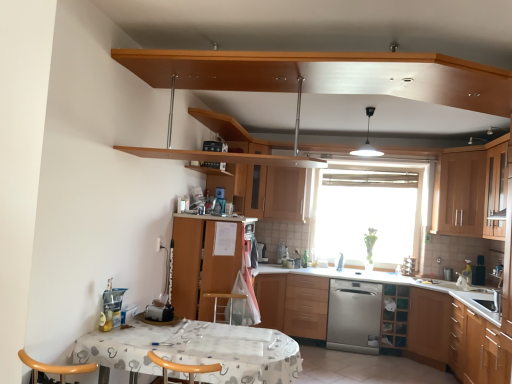
Question: Is transparent glass window at center behind wooden cabinet at center, arranged as the 6th cabinetry when viewed from the right?

Choices:
 (A) yes
 (B) no

Answer: (A)

Question: Considering the relative sizes of transparent glass window at center and wooden cabinet at center, which appears as the 1th cabinetry when viewed from the left, in the image provided, is transparent glass window at center bigger than wooden cabinet at center, which appears as the 1th cabinetry when viewed from the left,?

Choices:
 (A) yes
 (B) no

Answer: (B)

Question: Is transparent glass window at center facing towards wooden cabinet at center, which appears as the 1th cabinetry when viewed from the left?

Choices:
 (A) no
 (B) yes

Answer: (A)

Question: From the image's perspective, is transparent glass window at center over wooden cabinet at center, which appears as the 1th cabinetry when viewed from the left?

Choices:
 (A) no
 (B) yes

Answer: (B)

Question: Is transparent glass window at center turned away from wooden cabinet at center, which appears as the 1th cabinetry when viewed from the left?

Choices:
 (A) no
 (B) yes

Answer: (A)

Question: From a real-world perspective, is transparent glass window at center on top of wooden cabinet at center, which appears as the 1th cabinetry when viewed from the left?

Choices:
 (A) yes
 (B) no

Answer: (A)

Question: Is wooden cabinet at right, which ranks as the second cabinetry in right-to-left order, facing away from wooden cabinet at lower center, placed as the 4th cabinetry when sorted from right to left?

Choices:
 (A) no
 (B) yes

Answer: (A)

Question: Does wooden cabinet at right, which ranks as the second cabinetry in right-to-left order, have a lesser width compared to wooden cabinet at lower center, acting as the 3th cabinetry starting from the left?

Choices:
 (A) no
 (B) yes

Answer: (B)

Question: From the image's perspective, is wooden cabinet at right, the 5th cabinetry from the left, located beneath wooden cabinet at lower center, acting as the 3th cabinetry starting from the left?

Choices:
 (A) no
 (B) yes

Answer: (A)

Question: Is wooden cabinet at right, the 5th cabinetry from the left, facing towards wooden cabinet at lower center, acting as the 3th cabinetry starting from the left?

Choices:
 (A) yes
 (B) no

Answer: (B)

Question: Considering the relative sizes of wooden cabinet at right, which ranks as the second cabinetry in right-to-left order, and wooden cabinet at lower center, acting as the 3th cabinetry starting from the left, in the image provided, is wooden cabinet at right, which ranks as the second cabinetry in right-to-left order, smaller than wooden cabinet at lower center, acting as the 3th cabinetry starting from the left,?

Choices:
 (A) no
 (B) yes

Answer: (A)

Question: Considering the relative sizes of wooden cabinet at right, which ranks as the second cabinetry in right-to-left order, and wooden cabinet at lower center, placed as the 4th cabinetry when sorted from right to left, in the image provided, is wooden cabinet at right, which ranks as the second cabinetry in right-to-left order, wider than wooden cabinet at lower center, placed as the 4th cabinetry when sorted from right to left,?

Choices:
 (A) yes
 (B) no

Answer: (B)

Question: Is wooden cabinet at upper center, which appears as the second shelf when viewed from the back, wider than wooden cabinet at lower center, placed as the 4th cabinetry when sorted from right to left?

Choices:
 (A) no
 (B) yes

Answer: (A)